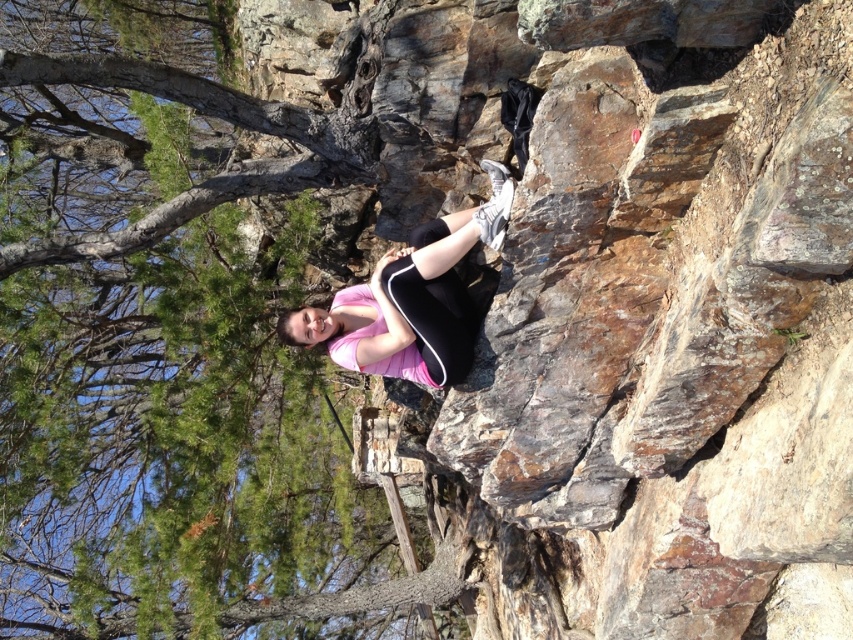
Between rusty stone cliff at center and pink matte leggings at center, which one has less height?

With less height is pink matte leggings at center.

Find the location of a particular element. The height and width of the screenshot is (640, 853). rusty stone cliff at center is located at coordinates (640, 330).